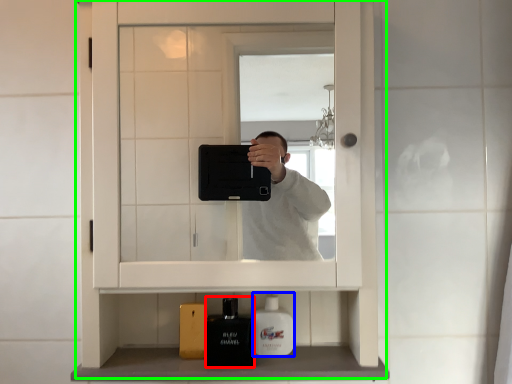
Question: Estimate the real-world distances between objects in this image. Which object is closer to toiletry (highlighted by a red box), mouthwash (highlighted by a blue box) or medicine cabinet (highlighted by a green box)?

Choices:
 (A) mouthwash
 (B) medicine cabinet

Answer: (A)